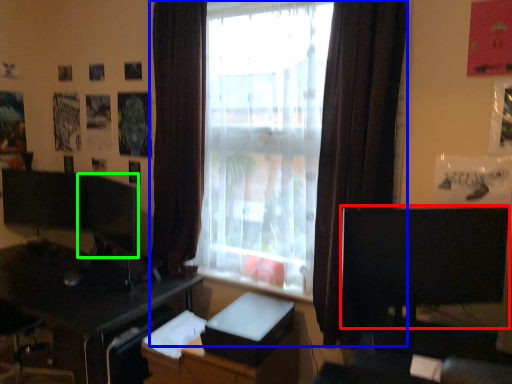
Question: Estimate the real-world distances between objects in this image. Which object is farther from computer monitor (highlighted by a red box), window (highlighted by a blue box) or computer monitor (highlighted by a green box)?

Choices:
 (A) window
 (B) computer monitor

Answer: (B)